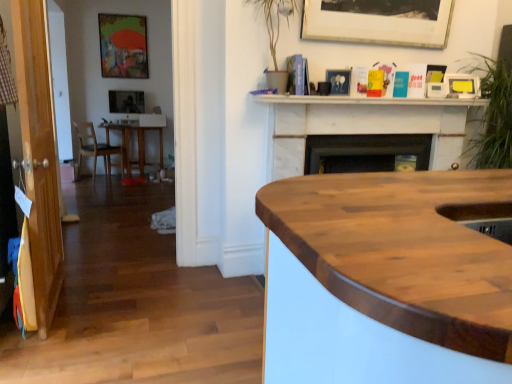
This screenshot has height=384, width=512. I want to click on vacant area that is in front of transparent wood door at left, so click(x=53, y=349).